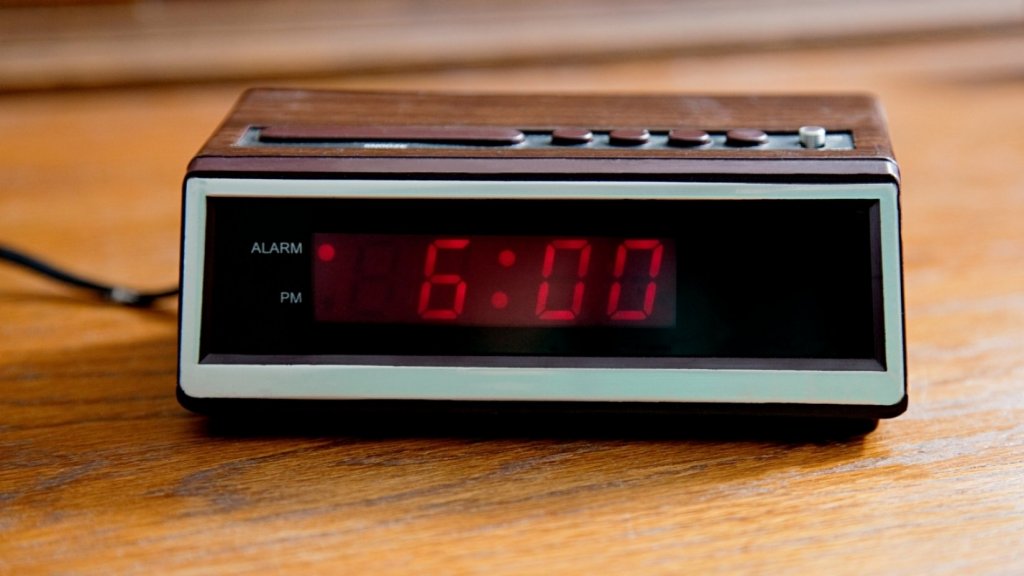
What are the coordinates of `dark brown wood grain casing of clock` in the screenshot? It's located at (519, 113).